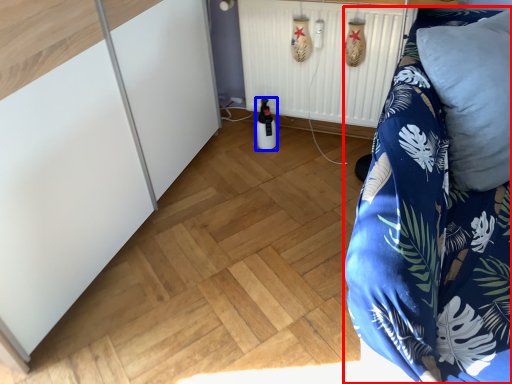
Question: Which point is closer to the camera, furniture (highlighted by a red box) or bottle (highlighted by a blue box)?

Choices:
 (A) furniture
 (B) bottle

Answer: (A)